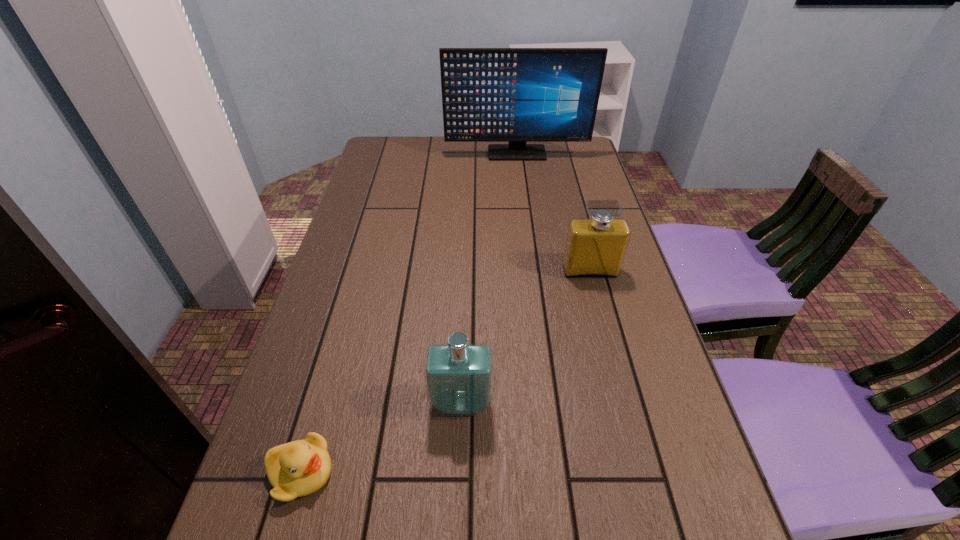
Locate an element on the screen. This screenshot has height=540, width=960. empty space between the second nearest object and the tallest object is located at coordinates (x=489, y=278).

Find the location of a particular element. vacant space that's between the farthest object and the nearer perfume is located at coordinates [x=489, y=278].

Find the location of a particular element. This screenshot has height=540, width=960. free point between the farthest object and the second farthest object is located at coordinates (553, 212).

Identify the location of blank region between the third farthest object and the second farthest object. pyautogui.click(x=525, y=337).

This screenshot has height=540, width=960. I want to click on vacant area that lies between the shortest object and the farthest object, so click(x=409, y=313).

I want to click on vacant area that lies between the computer monitor and the second nearest object, so click(x=489, y=278).

Where is `free point between the shortest object and the tallest object`? The height and width of the screenshot is (540, 960). free point between the shortest object and the tallest object is located at coordinates (409, 313).

Locate an element on the screen. The image size is (960, 540). object that stands as the closest to the third nearest object is located at coordinates (458, 375).

Locate an element on the screen. The height and width of the screenshot is (540, 960). object that stands as the third closest to the third nearest object is located at coordinates (299, 468).

The image size is (960, 540). Identify the location of vacant point that satisfies the following two spatial constraints: 1. on the front label of the third farthest object; 2. at the face of the duckling. (459, 472).